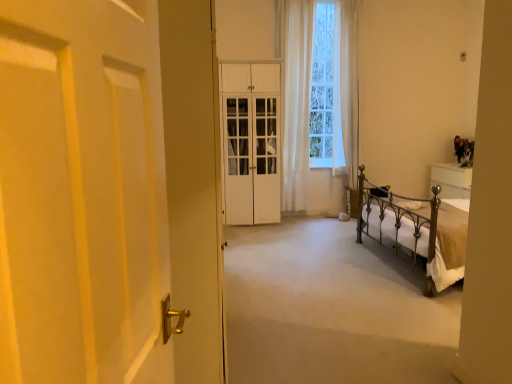
This screenshot has width=512, height=384. What are the coordinates of `vacant space in white sheer curtain at center (from a real-world perspective)` in the screenshot? It's located at (297, 221).